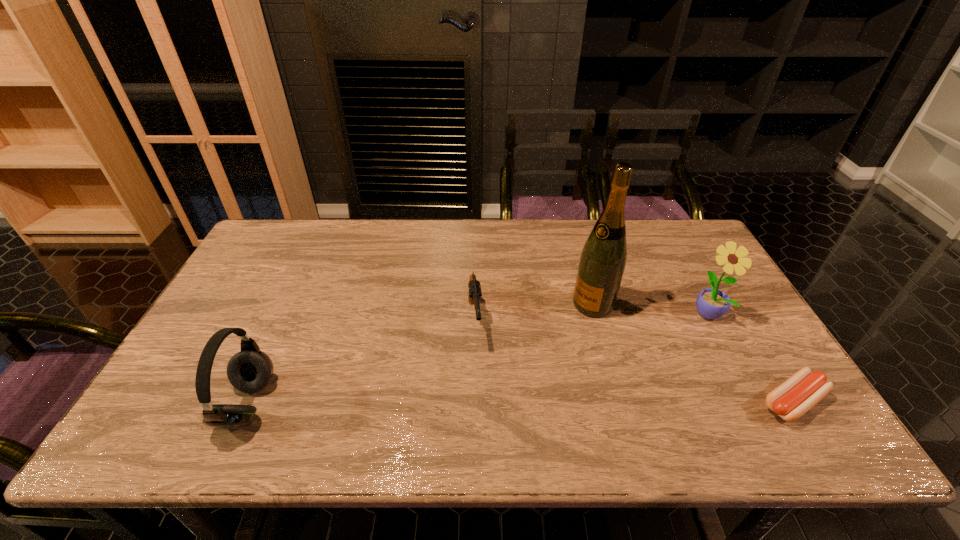
You are a GUI agent. You are given a task and a screenshot of the screen. Output one action in this format:
    pyautogui.click(x=<x>, y=<y>)
    Task: Click on the sausage located in the near edge section of the desktop
    Image resolution: width=960 pixels, height=540 pixels.
    Given the screenshot: What is the action you would take?
    pyautogui.click(x=803, y=390)

Locate an element on the screen. The height and width of the screenshot is (540, 960). sausage at the right edge is located at coordinates (803, 390).

The height and width of the screenshot is (540, 960). What are the coordinates of `sunflower at the right edge` in the screenshot? It's located at pos(711,303).

Locate an element on the screen. This screenshot has width=960, height=540. object positioned at the near right corner is located at coordinates (803, 390).

The width and height of the screenshot is (960, 540). What are the coordinates of `vacant space at the far edge of the desktop` in the screenshot? It's located at (378, 259).

Locate an element on the screen. This screenshot has height=540, width=960. vacant space at the near edge of the desktop is located at coordinates (695, 409).

I want to click on free spot at the left edge of the desktop, so click(x=254, y=304).

In the image, there is a desktop. Where is `free space at the right edge`? This screenshot has height=540, width=960. free space at the right edge is located at coordinates (729, 322).

This screenshot has height=540, width=960. I want to click on free space at the far left corner of the desktop, so click(297, 241).

Locate an element on the screen. vacant space at the far right corner of the desktop is located at coordinates (689, 237).